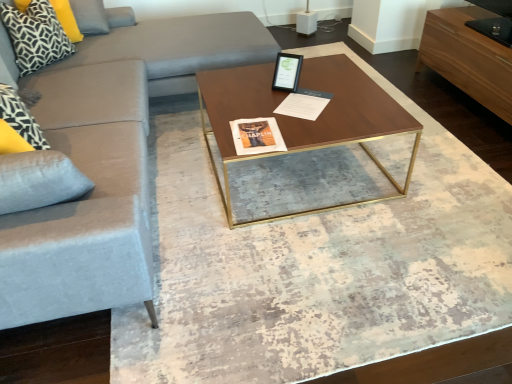
This screenshot has height=384, width=512. Find the location of `free space to the left of white paper at center`. free space to the left of white paper at center is located at coordinates (254, 101).